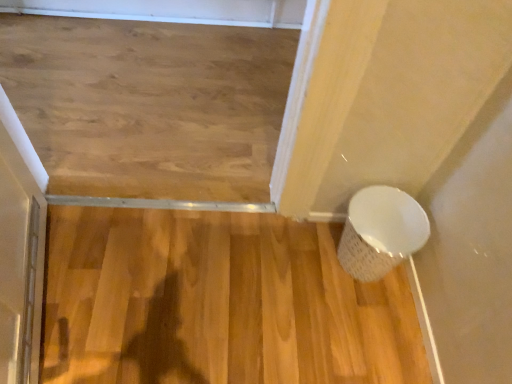
Locate an element on the screen. The height and width of the screenshot is (384, 512). free space in front of white textured basket at lower right is located at coordinates (390, 326).